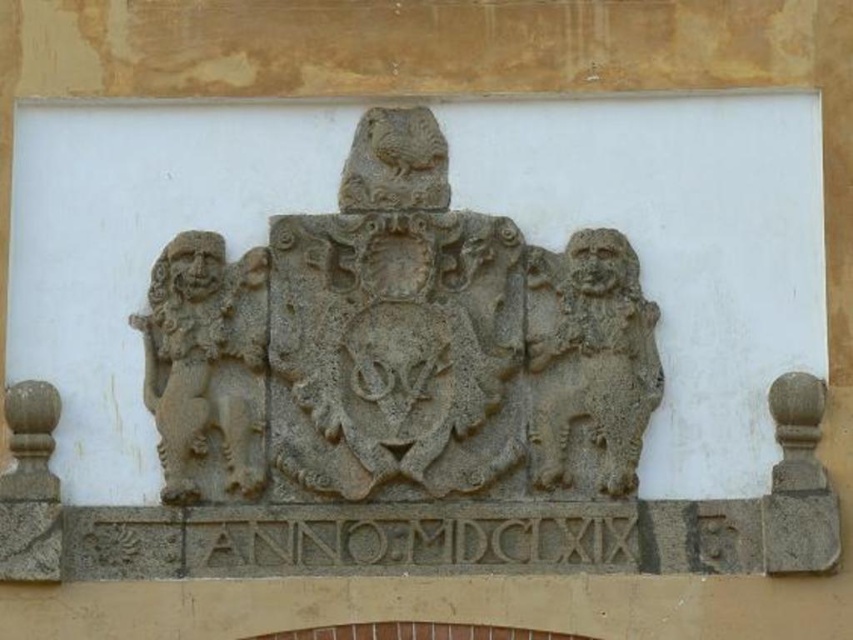
From the picture: You are an architect designing a new building and need to know the spatial relationship between the gray stone coat of arms at center and the gray stone lion at left. Based on the image, which object is wider?

The gray stone coat of arms at center might be wider than gray stone lion at left according to the description.

In the scene shown: You are an architect examining a historical coat of arms. You notice a point marked at coordinates (397, 348). Based on the scene, where exactly is this point located?

The point marked at coordinates (397, 348) is on the gray stone coat of arms at center.

You are an art conservator examining the stone heraldic emblem. You notice two points marked on the emblem at coordinates point (415, 125) and point (531, 307). If you were to draw a straight line between these two points, which point would be closer to the viewer?

Point (531, 307) is closer to the viewer because point (415, 125) is behind it.